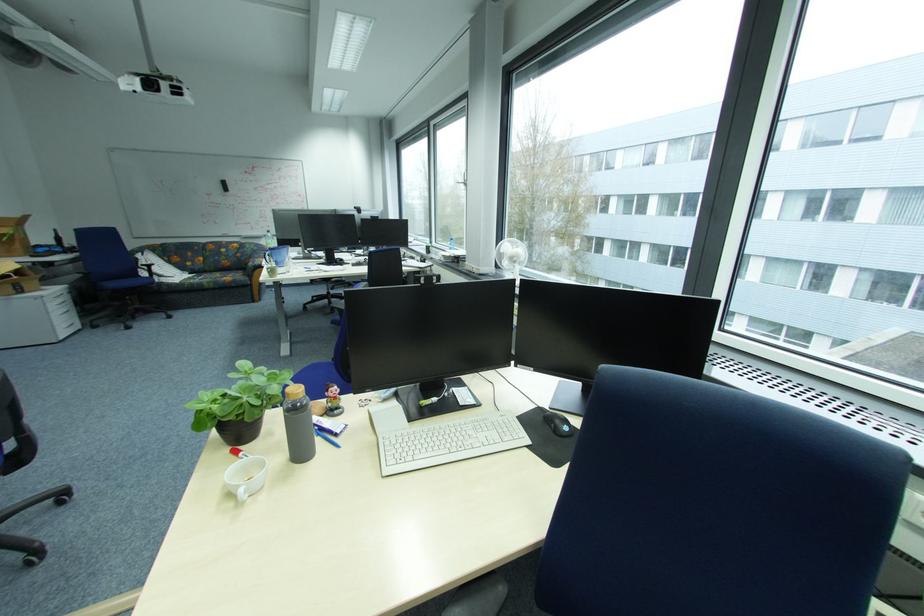
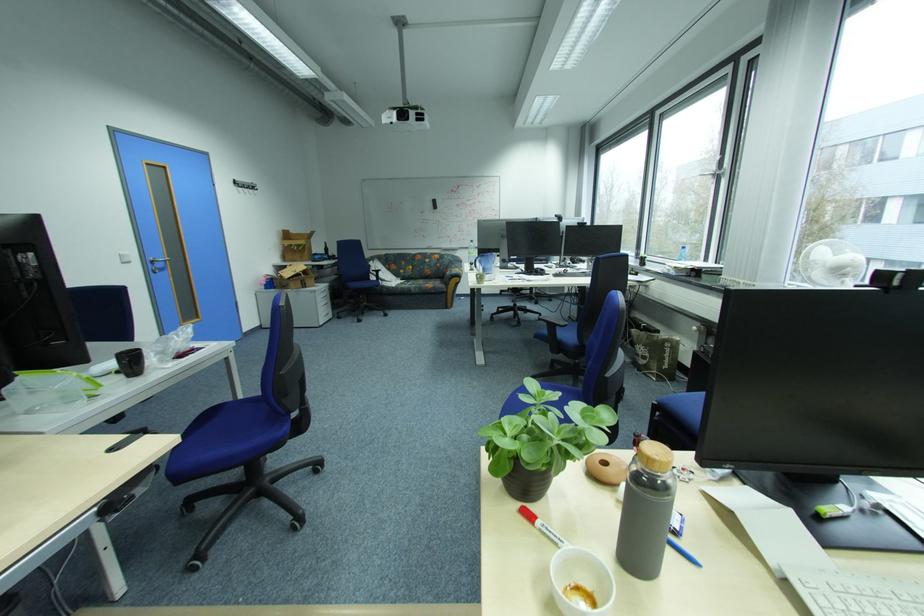
Question: The images are taken continuously from a first-person perspective. In which direction is your viewpoint rotating?

Choices:
 (A) Left
 (B) Right
 (C) Up
 (D) Down

Answer: (A)